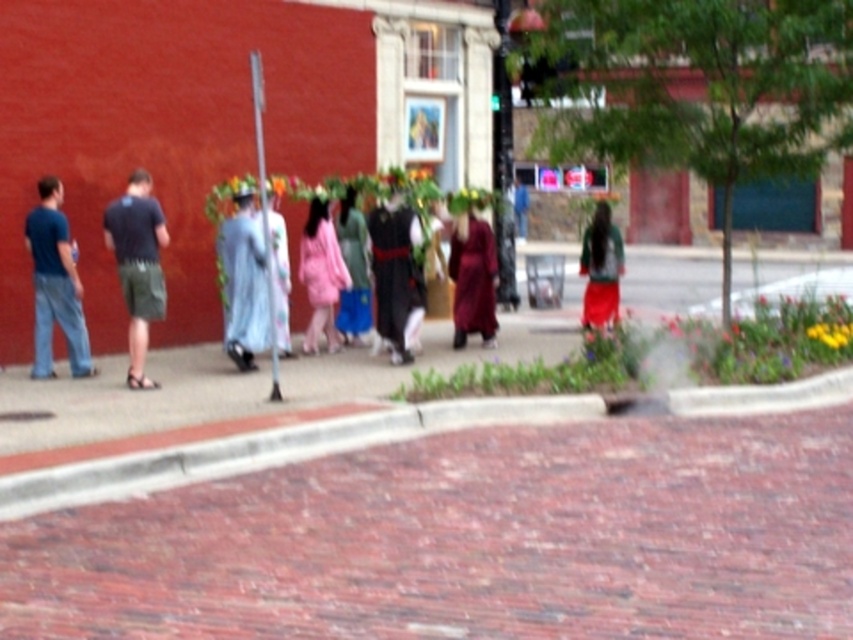
Is brick pavement at center below green fabric dress at center?

Yes.

Does brick pavement at center appear on the left side of green fabric dress at center?

Yes, brick pavement at center is to the left of green fabric dress at center.

Is point (589, 452) more distant than point (616, 272)?

No.

This screenshot has height=640, width=853. Find the location of `brick pavement at center`. brick pavement at center is located at coordinates (469, 540).

Does point (352, 316) come in front of point (286, 307)?

No, (352, 316) is behind (286, 307).

Is matte blue dress at center taller than light blue fabric dress at center?

Incorrect, matte blue dress at center's height is not larger of light blue fabric dress at center's.

Is point (341, 310) closer to camera compared to point (276, 257)?

No, (341, 310) is behind (276, 257).

Locate an element on the screen. The height and width of the screenshot is (640, 853). matte blue dress at center is located at coordinates (352, 275).

Can you confirm if brick pavement at center is positioned below pink satin dress at center?

Indeed, brick pavement at center is positioned under pink satin dress at center.

Which is more to the left, brick pavement at center or pink satin dress at center?

brick pavement at center is more to the left.

Where is `brick pavement at center`? The width and height of the screenshot is (853, 640). brick pavement at center is located at coordinates (469, 540).